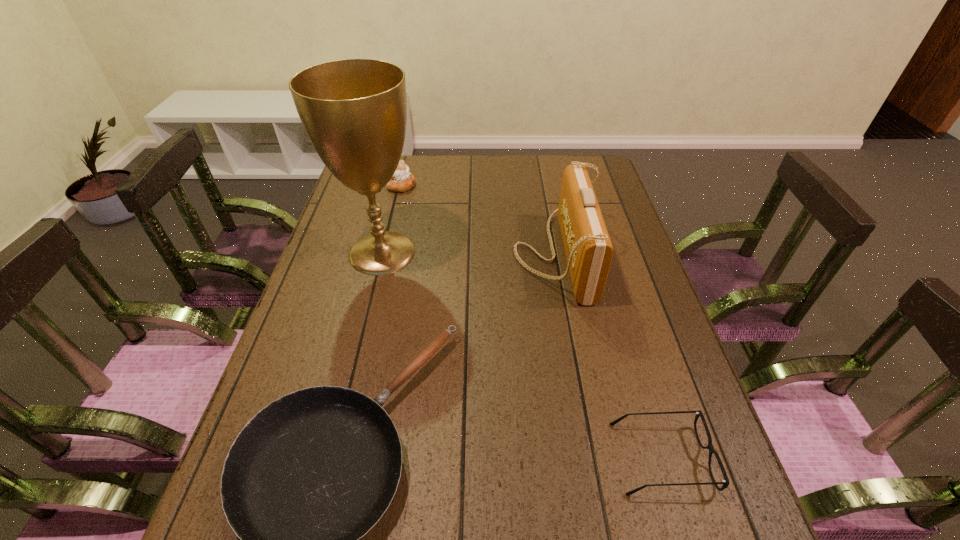
Where is `free location at the left edge`? The width and height of the screenshot is (960, 540). free location at the left edge is located at coordinates (308, 327).

Identify the location of free region at the right edge of the desktop. This screenshot has width=960, height=540. (626, 222).

Identify the location of free space between the third shortest object and the spectacles. (531, 322).

The height and width of the screenshot is (540, 960). I want to click on free space between the pastry and the trophy cup, so click(392, 219).

I want to click on unoccupied area between the pastry and the spectacles, so click(x=531, y=322).

The width and height of the screenshot is (960, 540). I want to click on free space that is in between the farthest object and the spectacles, so click(x=531, y=322).

Find the location of `blank region between the third tallest object and the spectacles`. blank region between the third tallest object and the spectacles is located at coordinates (531, 322).

This screenshot has width=960, height=540. I want to click on vacant space in between the spectacles and the tallest object, so click(521, 355).

Find the location of a particular element. vacant point located between the tallest object and the spectacles is located at coordinates (521, 355).

This screenshot has height=540, width=960. In order to click on the third closest object to the second tallest object in this screenshot , I will do `click(725, 482)`.